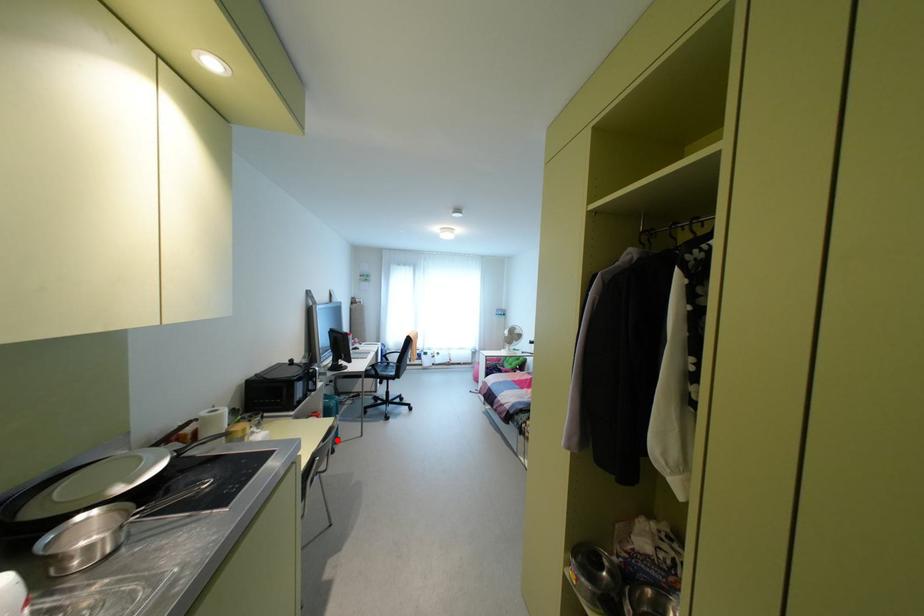
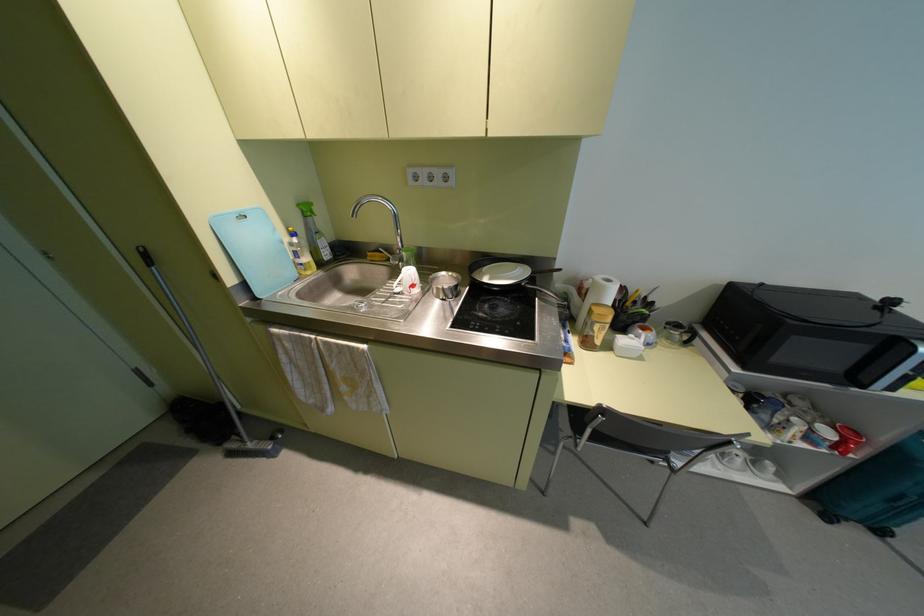
In the second image, find the point that corresponds to the highlighted location in the first image.

(880, 531)